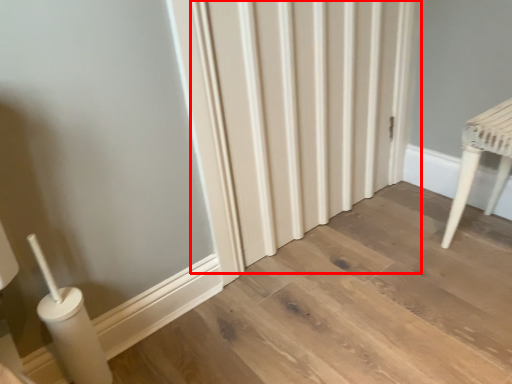
Question: From the image, what is the correct spatial relationship of radiator (annotated by the red box) in relation to furniture?

Choices:
 (A) right
 (B) left

Answer: (B)